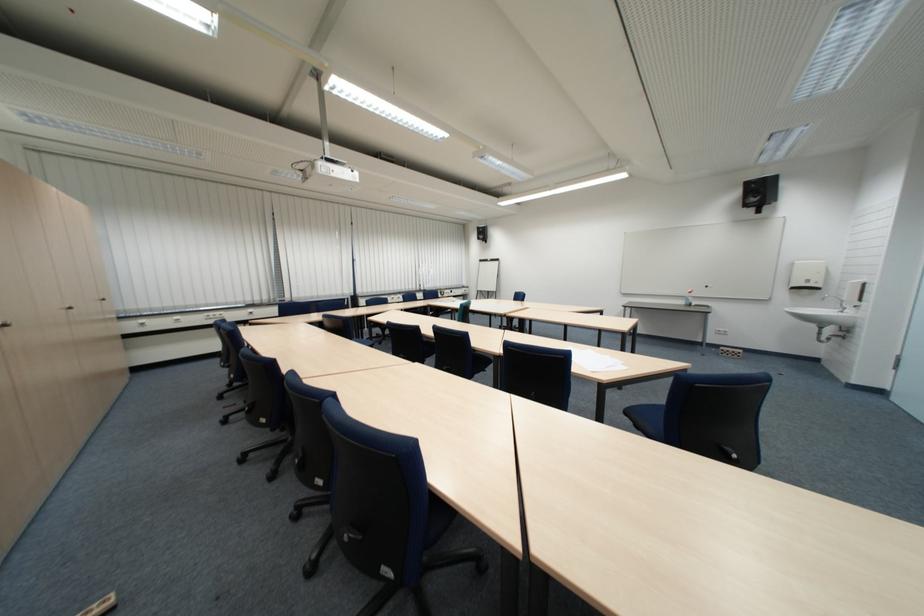
Describe the element at coordinates (834, 302) in the screenshot. This screenshot has width=924, height=616. I see `the faucet handle` at that location.